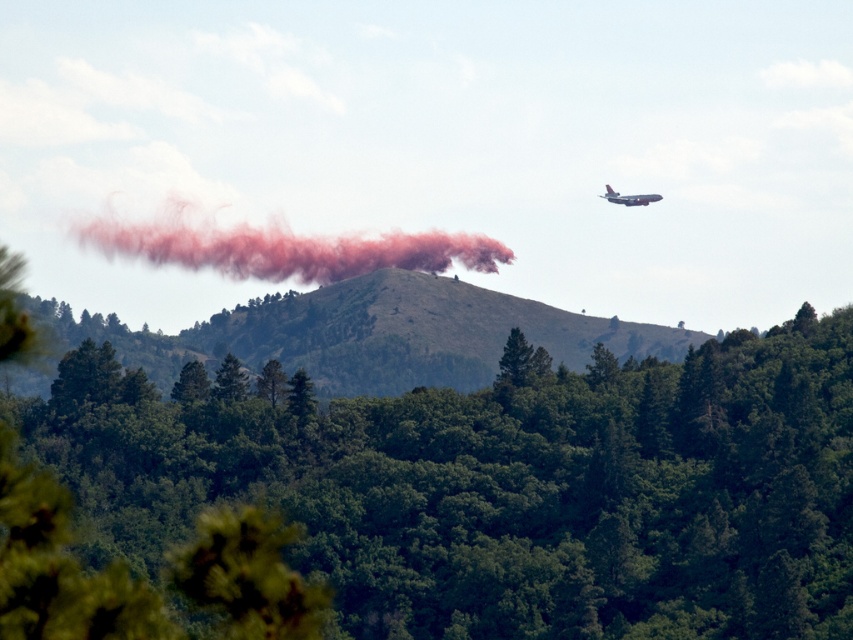
Question: Considering the real-world distances, which object is closest to the smooth brown hill at center?

Choices:
 (A) red matte smoke at center
 (B) green leafy tree at center

Answer: (A)

Question: Which point is farther to the camera?

Choices:
 (A) coord(44,403)
 (B) coord(265,374)
 (C) coord(349,296)

Answer: (A)

Question: Which point is farther from the camera taking this photo?

Choices:
 (A) (640, 204)
 (B) (476, 332)
 (C) (259, 381)
 (D) (126, 410)

Answer: (A)

Question: Does red matte smoke at center have a larger size compared to green matte tree at center?

Choices:
 (A) yes
 (B) no

Answer: (A)

Question: Does green matte tree at center appear on the right side of metallic blue airplane at upper right?

Choices:
 (A) no
 (B) yes

Answer: (A)

Question: Is green leafy tree at center wider than red matte smoke at center?

Choices:
 (A) no
 (B) yes

Answer: (B)